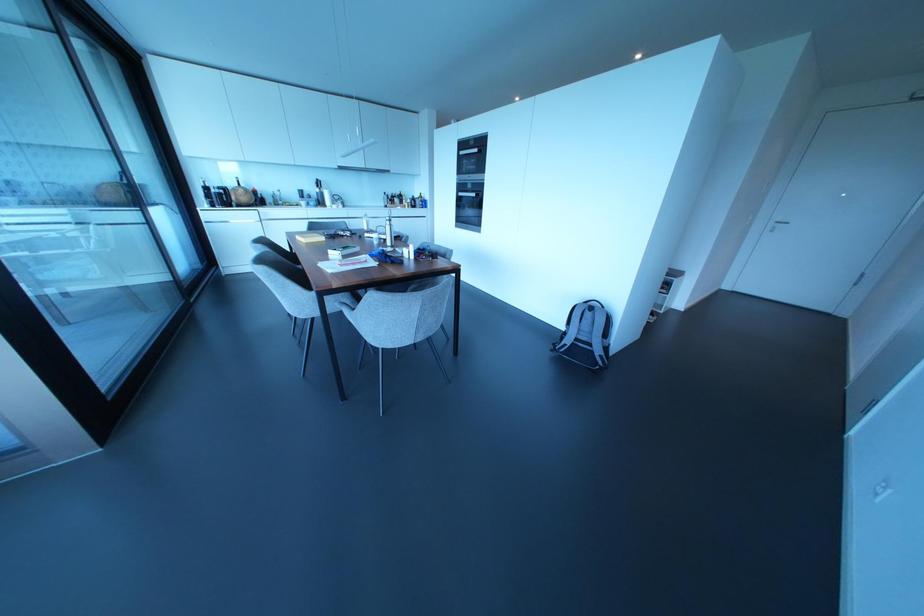
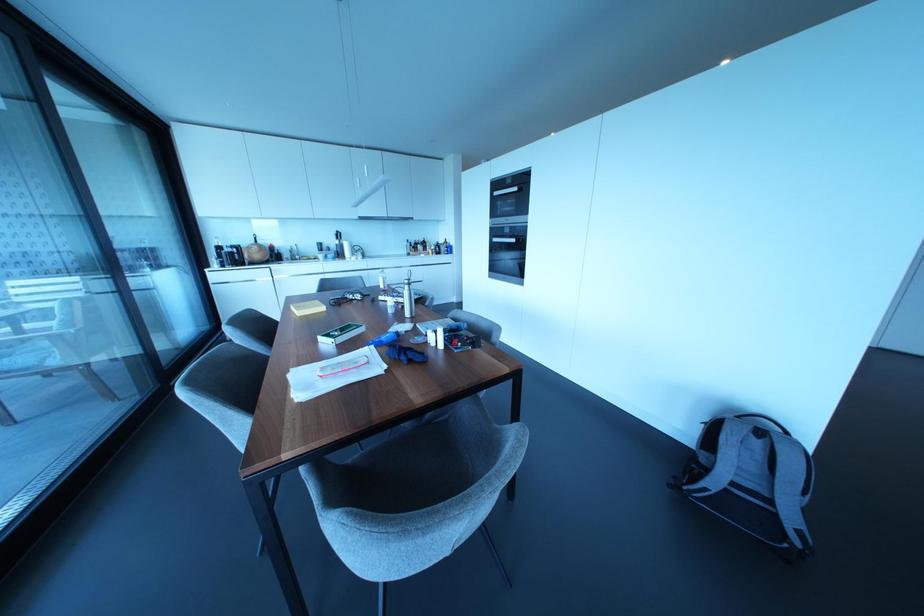
Locate, in the second image, the point that corresponds to (x=475, y=150) in the first image.

(515, 188)